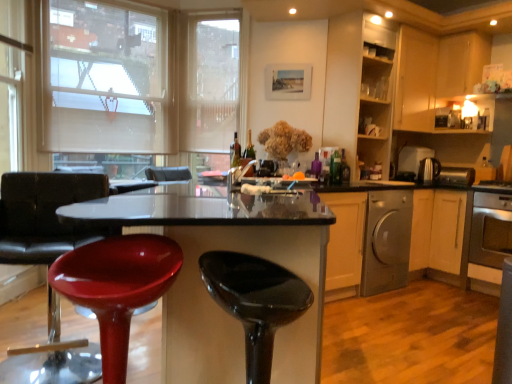
Question: Can you confirm if translucent glass bottle at center, positioned as the 2th bottle in left-to-right order, is shorter than green glass bottle at center, which is the first bottle in left-to-right order?

Choices:
 (A) no
 (B) yes

Answer: (B)

Question: From the image's perspective, is translucent glass bottle at center, which is the second bottle in right-to-left order, under green glass bottle at center, which is the first bottle in left-to-right order?

Choices:
 (A) yes
 (B) no

Answer: (B)

Question: Is the depth of translucent glass bottle at center, which is the second bottle in right-to-left order, greater than that of green glass bottle at center, which is the first bottle in left-to-right order?

Choices:
 (A) no
 (B) yes

Answer: (A)

Question: Is translucent glass bottle at center, positioned as the 2th bottle in left-to-right order, facing towards green glass bottle at center, which is the first bottle in left-to-right order?

Choices:
 (A) yes
 (B) no

Answer: (B)

Question: Is translucent glass bottle at center, which is the second bottle in right-to-left order, in front of green glass bottle at center, the 3th bottle when ordered from right to left?

Choices:
 (A) no
 (B) yes

Answer: (B)

Question: Is silver metallic dishwasher at lower right inside or outside of glossy plastic table at center?

Choices:
 (A) inside
 (B) outside

Answer: (B)

Question: From a real-world perspective, is silver metallic dishwasher at lower right above or below glossy plastic table at center?

Choices:
 (A) above
 (B) below

Answer: (B)

Question: Visually, is silver metallic dishwasher at lower right positioned to the left or to the right of glossy plastic table at center?

Choices:
 (A) left
 (B) right

Answer: (B)

Question: Is silver metallic dishwasher at lower right bigger or smaller than glossy plastic table at center?

Choices:
 (A) small
 (B) big

Answer: (A)

Question: Is metallic silver toaster at right, the second appliance viewed from the right, to the left or to the right of beige fabric window screen at upper left, which is the second window screen in right-to-left order, in the image?

Choices:
 (A) left
 (B) right

Answer: (B)

Question: Is metallic silver toaster at right, the 2th appliance from the left, inside the boundaries of beige fabric window screen at upper left, which is the second window screen in right-to-left order, or outside?

Choices:
 (A) inside
 (B) outside

Answer: (B)

Question: From their relative heights in the image, would you say metallic silver toaster at right, the second appliance viewed from the right, is taller or shorter than beige fabric window screen at upper left, which is the second window screen in right-to-left order?

Choices:
 (A) tall
 (B) short

Answer: (B)

Question: Is metallic silver toaster at right, the second appliance viewed from the right, in front of or behind beige fabric window screen at upper left, which appears as the 1th window screen when viewed from the left, in the image?

Choices:
 (A) behind
 (B) front

Answer: (A)

Question: Considering the relative positions of metallic silver toaster at right, marked as the 1th appliance in a right-to-left arrangement, and matte glass bottle at center, acting as the 1th bottle starting from the right, in the image provided, is metallic silver toaster at right, marked as the 1th appliance in a right-to-left arrangement, to the left or to the right of matte glass bottle at center, acting as the 1th bottle starting from the right,?

Choices:
 (A) left
 (B) right

Answer: (B)

Question: Considering the positions of metallic silver toaster at right, marked as the 1th appliance in a right-to-left arrangement, and matte glass bottle at center, acting as the 1th bottle starting from the right, in the image, is metallic silver toaster at right, marked as the 1th appliance in a right-to-left arrangement, taller or shorter than matte glass bottle at center, acting as the 1th bottle starting from the right,?

Choices:
 (A) tall
 (B) short

Answer: (B)